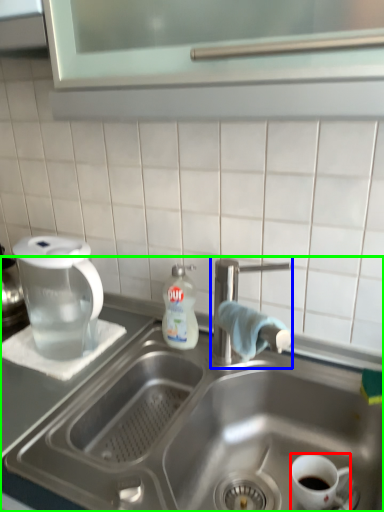
Question: Based on their relative distances, which object is farther from coffee cup (highlighted by a red box)? Choose from tap (highlighted by a blue box) and sink (highlighted by a green box).

Choices:
 (A) tap
 (B) sink

Answer: (A)